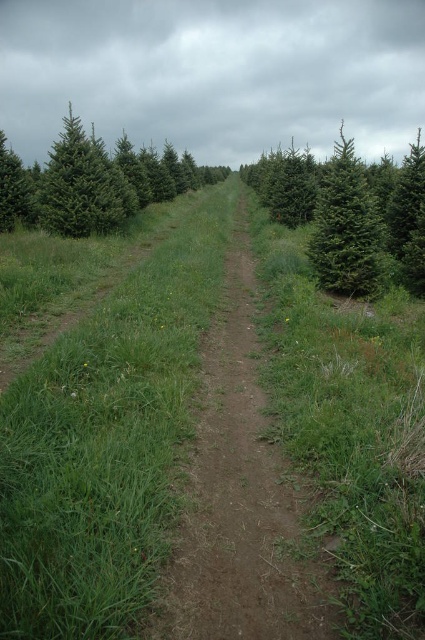
Between brown dirt track at center and green matte evergreen tree at left, which one is positioned higher?

green matte evergreen tree at left

Based on the photo, can you confirm if brown dirt track at center is positioned below green matte evergreen tree at left?

Indeed, brown dirt track at center is positioned under green matte evergreen tree at left.

Which is in front, point (178, 540) or point (175, 177)?

Point (178, 540) is in front.

The image size is (425, 640). Identify the location of brown dirt track at center. (238, 493).

Does green matte evergreen tree at right appear on the left side of green matte tree at left?

No, green matte evergreen tree at right is not to the left of green matte tree at left.

Is point (331, 257) positioned behind point (28, 177)?

That is False.

Find the location of a particular element. green matte evergreen tree at right is located at coordinates (345, 227).

Who is taller, green matte evergreen tree at center-right or green matte evergreen tree at right?

green matte evergreen tree at center-right

In the scene shown: Is green matte evergreen tree at center-right smaller than green matte evergreen tree at right?

No, green matte evergreen tree at center-right is not smaller than green matte evergreen tree at right.

Is point (382, 200) positioned in front of point (376, 209)?

No, it is behind (376, 209).

Where is `green matte evergreen tree at center-right`? The image size is (425, 640). green matte evergreen tree at center-right is located at coordinates (348, 211).